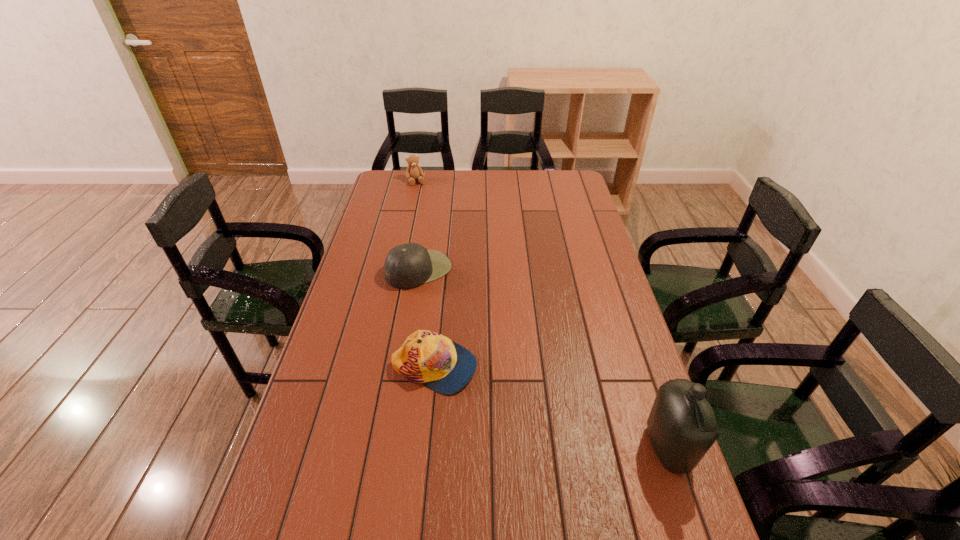
Image resolution: width=960 pixels, height=540 pixels. I want to click on free spot between the second nearest object and the bottle, so click(x=551, y=408).

Locate an element on the screen. This screenshot has height=540, width=960. free space between the second farthest object and the farthest object is located at coordinates (418, 225).

Select which object appears as the closest to the rightmost object. Please provide its 2D coordinates. Your answer should be formatted as a tuple, i.e. [(x, y)], where the tuple contains the x and y coordinates of a point satisfying the conditions above.

[(432, 359)]

Where is `object that is the closest to the rightmost object`? The width and height of the screenshot is (960, 540). object that is the closest to the rightmost object is located at coordinates (432, 359).

You are a GUI agent. You are given a task and a screenshot of the screen. Output one action in this format:
    pyautogui.click(x=<x>, y=<y>)
    Task: Click on the free space that satisfies the following two spatial constraints: 1. on the front side of the nearer cap; 2. on the bill of the third nearest object
    This screenshot has width=960, height=540.
    Given the screenshot: What is the action you would take?
    pyautogui.click(x=403, y=367)

I want to click on vacant space that satisfies the following two spatial constraints: 1. on the front side of the second farthest object; 2. on the bill of the third farthest object, so click(x=403, y=367).

Where is `free point that satisfies the following two spatial constraints: 1. on the front side of the nearer cap; 2. on the bill of the third nearest object`? free point that satisfies the following two spatial constraints: 1. on the front side of the nearer cap; 2. on the bill of the third nearest object is located at coordinates (403, 367).